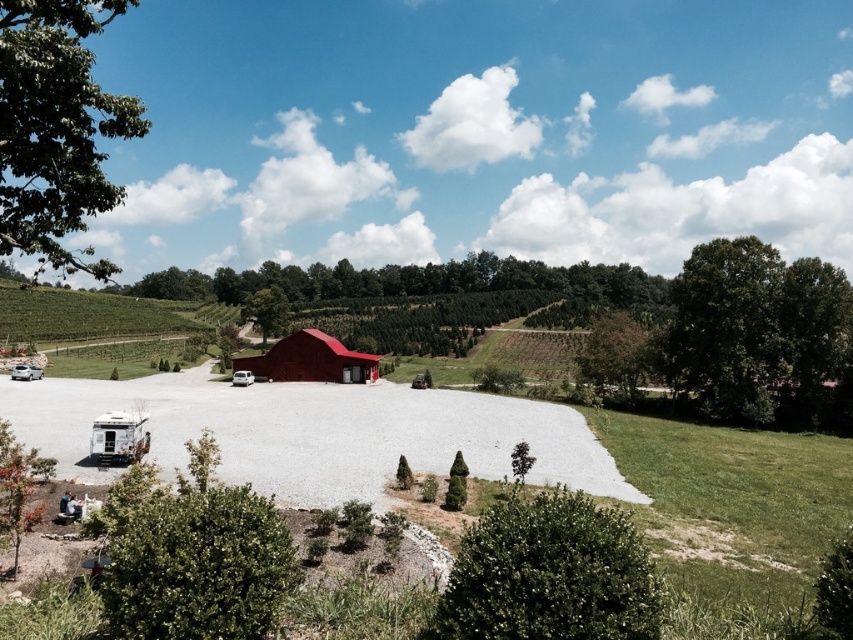
You are standing at the edge of the gravel parking area and want to walk to the white matte recreational vehicle at center. There is another white matte recreational vehicle at lower left in your path. Which vehicle will you pass first?

You will pass the white matte recreational vehicle at lower left first since it is closer to you than the white matte recreational vehicle at center.